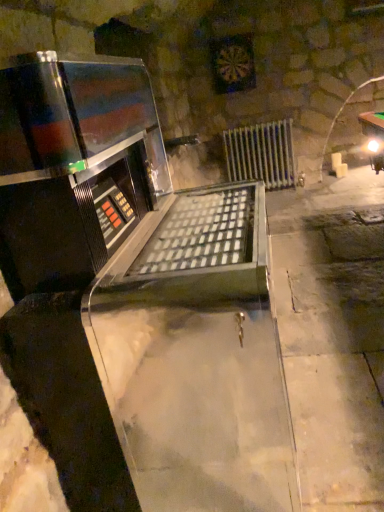
Question: In terms of width, does silver metallic radiator at center look wider or thinner when compared to shiny metallic wine cellar at center?

Choices:
 (A) thin
 (B) wide

Answer: (A)

Question: From a real-world perspective, is silver metallic radiator at center positioned above or below shiny metallic wine cellar at center?

Choices:
 (A) below
 (B) above

Answer: (A)

Question: Do you think silver metallic radiator at center is within shiny metallic wine cellar at center, or outside of it?

Choices:
 (A) inside
 (B) outside

Answer: (B)

Question: From the image's perspective, relative to silver metallic radiator at center, is shiny metallic wine cellar at center above or below?

Choices:
 (A) above
 (B) below

Answer: (B)

Question: From a real-world perspective, is shiny metallic wine cellar at center physically located above or below silver metallic radiator at center?

Choices:
 (A) above
 (B) below

Answer: (A)

Question: Considering the positions of shiny metallic wine cellar at center and silver metallic radiator at center in the image, is shiny metallic wine cellar at center wider or thinner than silver metallic radiator at center?

Choices:
 (A) thin
 (B) wide

Answer: (B)

Question: Considering their positions, is shiny metallic wine cellar at center located in front of or behind silver metallic radiator at center?

Choices:
 (A) front
 (B) behind

Answer: (A)